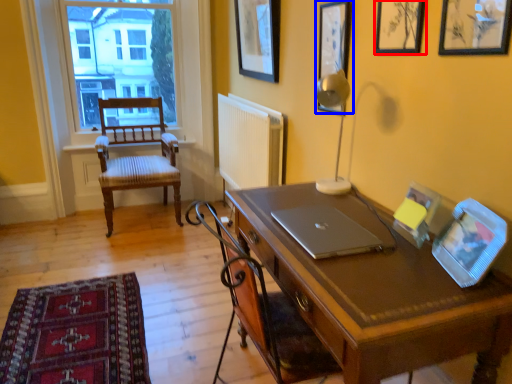
Question: Among these objects, which one is nearest to the camera, picture frame (highlighted by a red box) or picture frame (highlighted by a blue box)?

Choices:
 (A) picture frame
 (B) picture frame

Answer: (A)